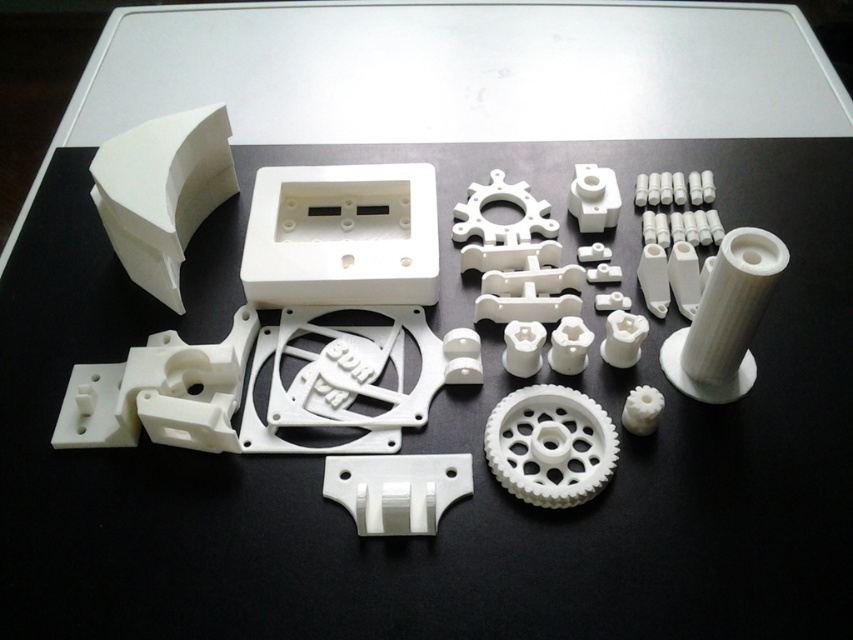
Is white matte plastic gear at upper left above white matte gear at center?

No, white matte plastic gear at upper left is not above white matte gear at center.

Who is more forward, (107, 228) or (598, 196)?

Point (107, 228) is in front.

Does point (173, 209) come farther from viewer compared to point (601, 186)?

No, it is not.

This screenshot has height=640, width=853. I want to click on white matte plastic gear at upper left, so click(x=161, y=192).

Which is in front, point (602, 448) or point (596, 211)?

Point (602, 448) is in front.

Consider the image. Is white plastic gear at center further to camera compared to white matte gear at center?

No, it is in front of white matte gear at center.

Does point (561, 404) come in front of point (618, 189)?

Yes, it is.

Find the location of a particular element. The height and width of the screenshot is (640, 853). white plastic gear at center is located at coordinates (550, 445).

I want to click on white matte plastic gear at upper left, so click(161, 192).

The width and height of the screenshot is (853, 640). Describe the element at coordinates (161, 192) in the screenshot. I see `white matte plastic gear at upper left` at that location.

Is point (177, 180) closer to viewer compared to point (523, 403)?

That is False.

This screenshot has width=853, height=640. Find the location of `white matte plastic gear at upper left`. white matte plastic gear at upper left is located at coordinates (161, 192).